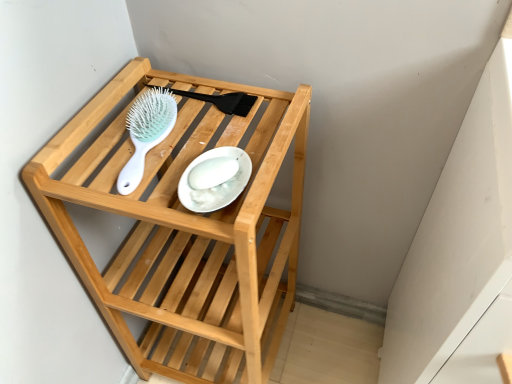
Locate an element on the screen. This screenshot has height=384, width=512. vacant point to the right of light blue plastic hairbrush at upper center is located at coordinates (232, 145).